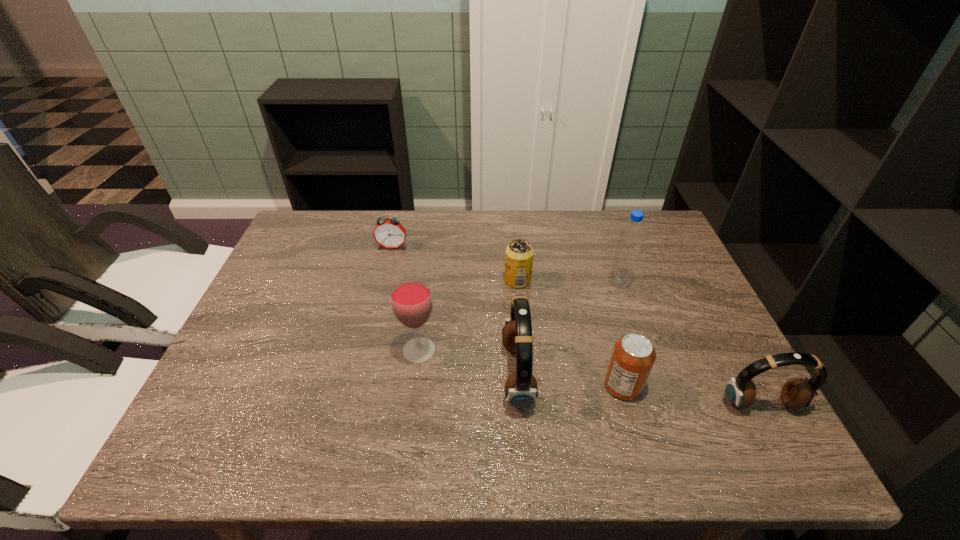
Locate an element on the screen. free region located on the left of the beer can is located at coordinates (372, 280).

Where is `vacant space located on the front of the water bottle`? This screenshot has height=540, width=960. vacant space located on the front of the water bottle is located at coordinates (626, 303).

In order to click on free region located 0.390m on the clock face of the farthest object in this screenshot , I will do `click(367, 354)`.

You are a GUI agent. You are given a task and a screenshot of the screen. Output one action in this format:
    pyautogui.click(x=<x>, y=<y>)
    Task: Click on the vacant space situated on the left of the can
    
    Given the screenshot: What is the action you would take?
    pyautogui.click(x=523, y=386)

Locate an element on the screen. The width and height of the screenshot is (960, 540). vacant space situated on the right of the second object from left to right is located at coordinates (593, 350).

Locate an element on the screen. The width and height of the screenshot is (960, 540). object present at the far edge is located at coordinates (389, 233).

Where is `can located at the near edge`? This screenshot has height=540, width=960. can located at the near edge is located at coordinates (633, 356).

The width and height of the screenshot is (960, 540). What are the coordinates of `object situated at the right edge` in the screenshot? It's located at (796, 393).

At what (x,y) coordinates should I click in order to perform the action: click on object that is at the near right corner. Please return your answer as a coordinate pair (x, y). Looking at the image, I should click on (796, 393).

Locate an element on the screen. The height and width of the screenshot is (540, 960). vacant space at the far edge of the desktop is located at coordinates (605, 219).